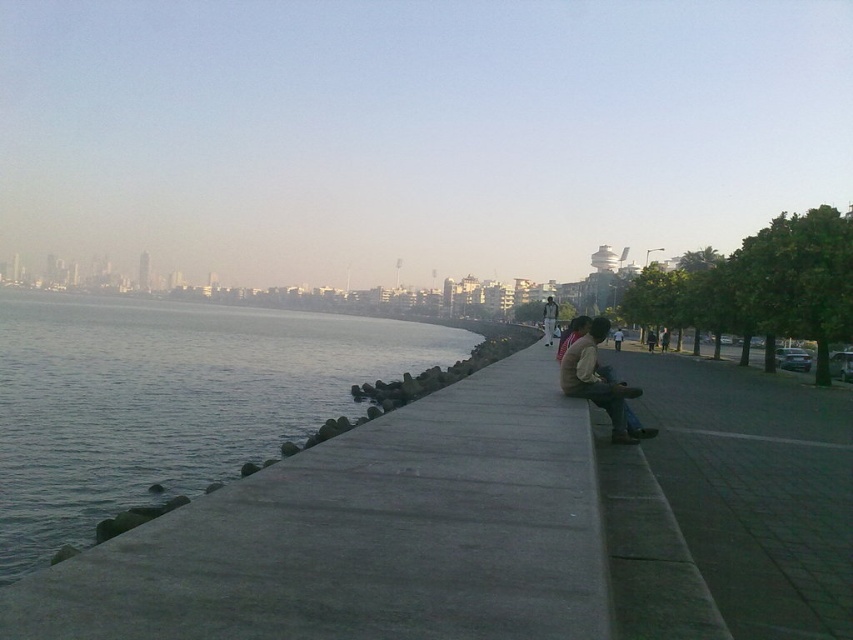
You are a photographer standing on the gray concrete waterway at lower left and want to take a photo of the matte brown jacket at center. Considering the height difference between the two, will you need to look up or down to frame the jacket properly?

The gray concrete waterway at lower left is much taller than the matte brown jacket at center, so you will need to look down to frame the jacket properly.

You are standing at the point marked as point (167, 401). Looking towards the gray concrete waterway at lower left, which direction should you walk to reach it?

Since you are already at the point where the gray concrete waterway at lower left is located, you are already at the waterway.

You are standing at the origin point of the coordinate system where the water is at the bottom of the image. The walkway runs horizontally from left to right. If the brown leather jacket at center is located at coordinate point 0.597, 0.702, what direction is it from your current position?

The brown leather jacket at center is located at coordinate point (598, 381). Since the origin is at the water edge, the jacket is positioned to the upper right direction from your current position.